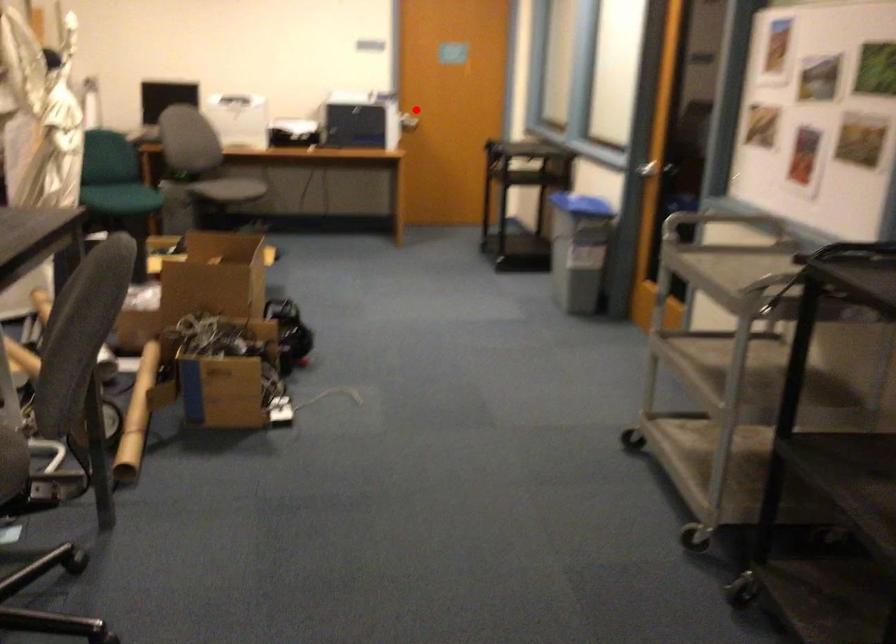
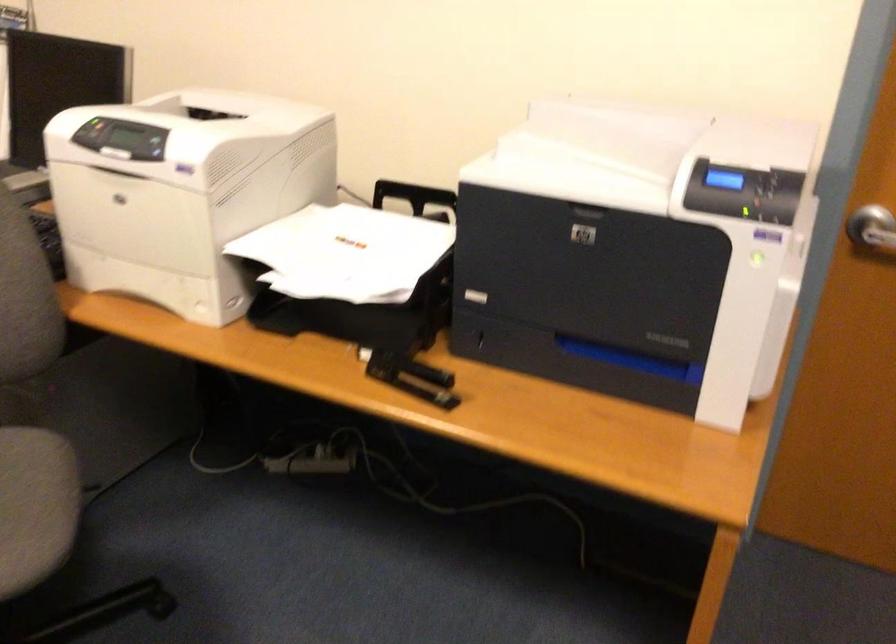
The point at the highlighted location is marked in the first image. Where is the corresponding point in the second image?

(872, 230)